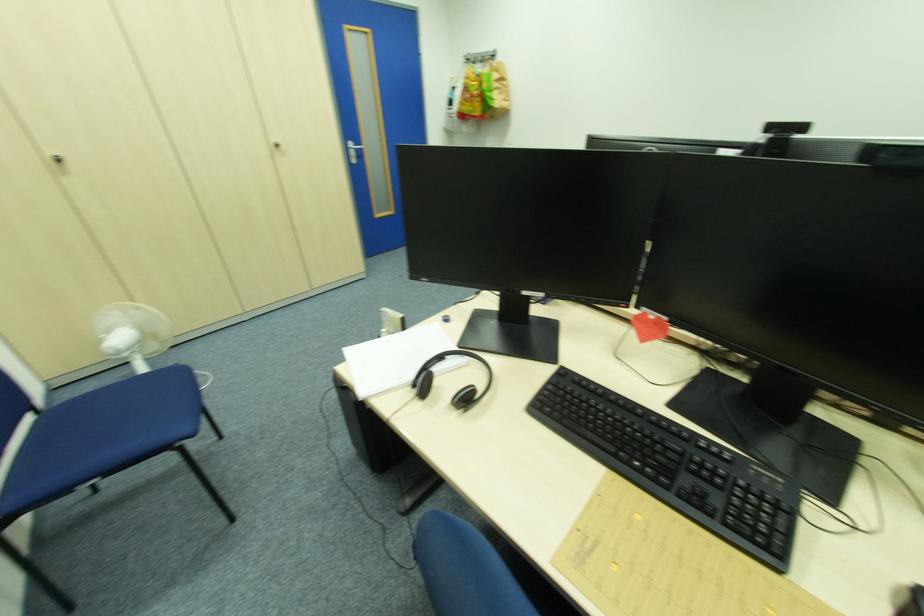
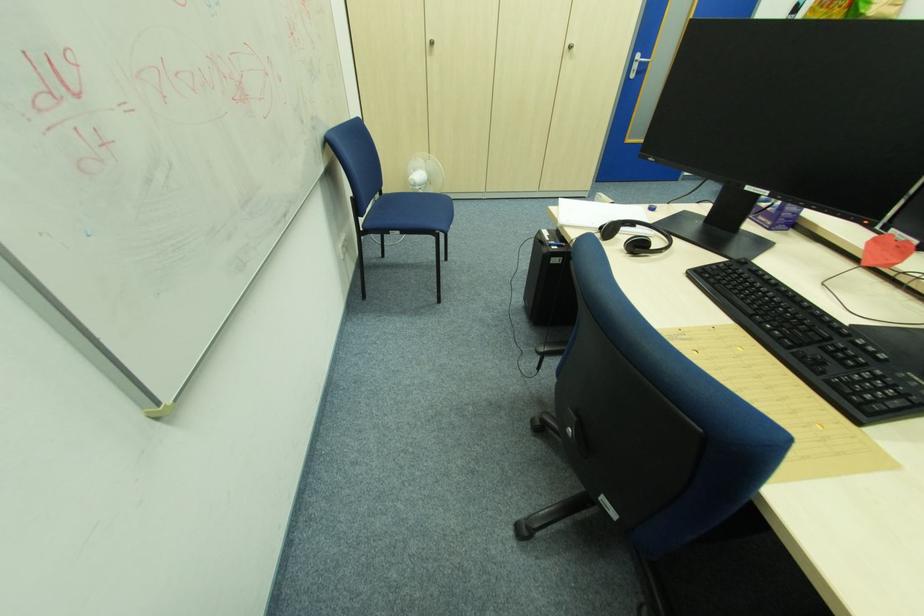
The point at (154, 336) is marked in the first image. Where is the corresponding point in the second image?

(434, 183)